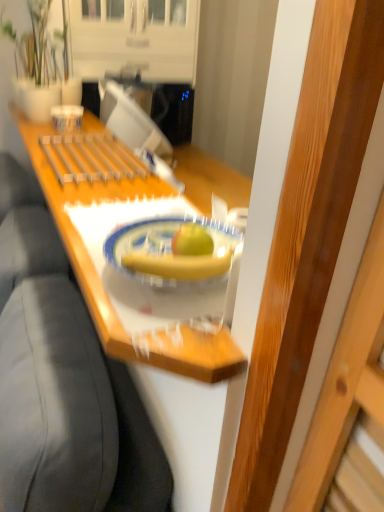
Question: Considering the positions of point (226, 373) and point (21, 41), is point (226, 373) closer or farther from the camera than point (21, 41)?

Choices:
 (A) closer
 (B) farther

Answer: (A)

Question: Is wooden tray at center spatially inside matte white vase at upper left, or outside of it?

Choices:
 (A) inside
 (B) outside

Answer: (B)

Question: Considering the real-world distances, which object is closest to the porcelain plate at center?

Choices:
 (A) matte white vase at upper left
 (B) wooden tray at center
 (C) yellow matte banana at center

Answer: (C)

Question: Considering the real-world distances, which object is closest to the yellow matte banana at center?

Choices:
 (A) matte white vase at upper left
 (B) porcelain plate at center
 (C) wooden tray at center

Answer: (B)